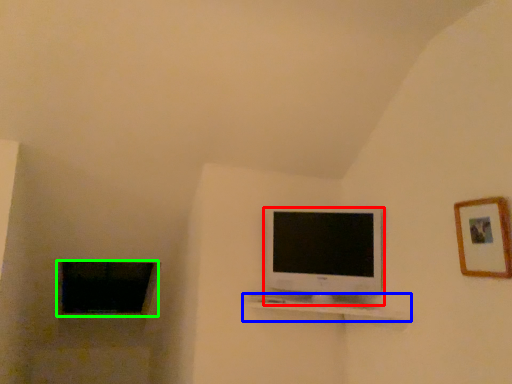
Question: Estimate the real-world distances between objects in this image. Which object is farther from television (highlighted by a red box), shelf (highlighted by a blue box) or window (highlighted by a green box)?

Choices:
 (A) shelf
 (B) window

Answer: (B)